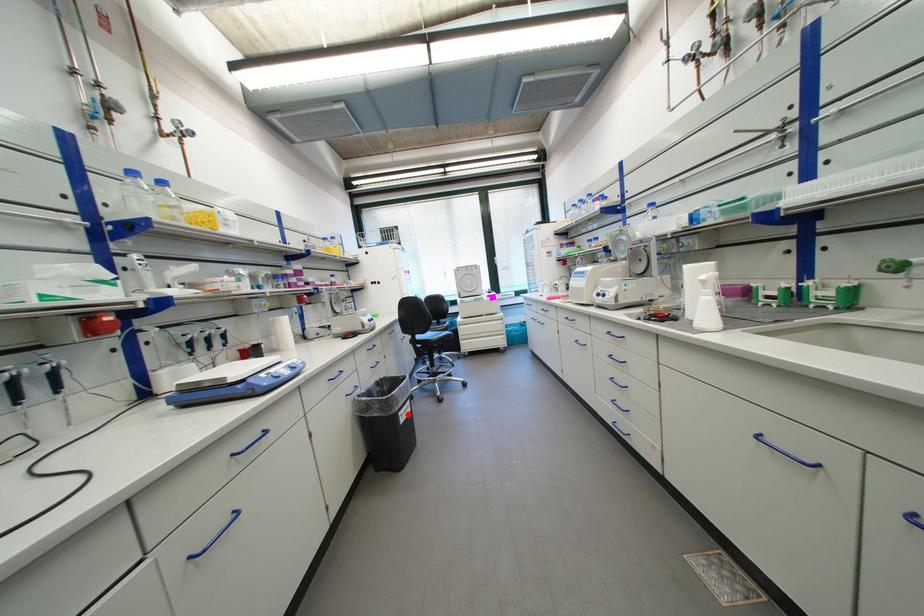
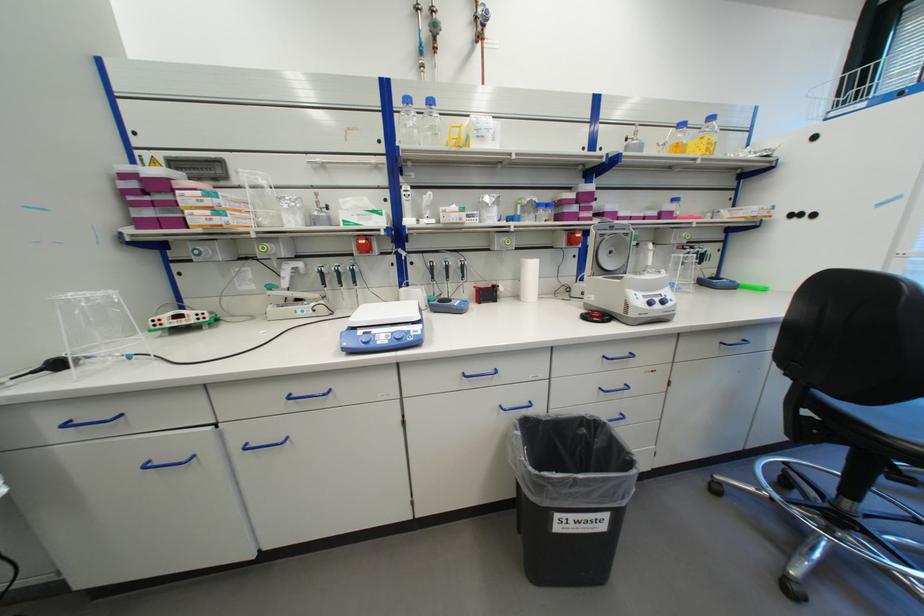
Question: A red point is marked in image1. In image2, is the corresponding 3D point closer to the camera or farther? Reply with the corresponding letter.

Choices:
 (A) The corresponding 3D point is closer.
 (B) The corresponding 3D point is farther.

Answer: (B)